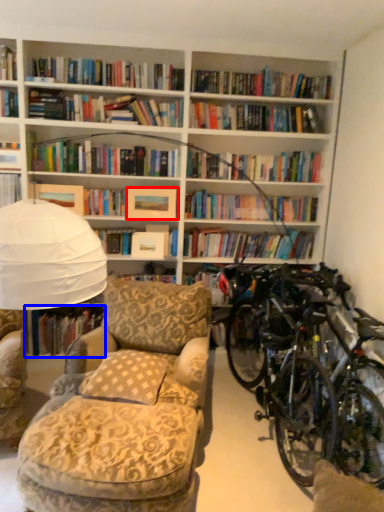
Question: Which point is closer to the camera, paperback book (highlighted by a red box) or book (highlighted by a blue box)?

Choices:
 (A) paperback book
 (B) book

Answer: (A)